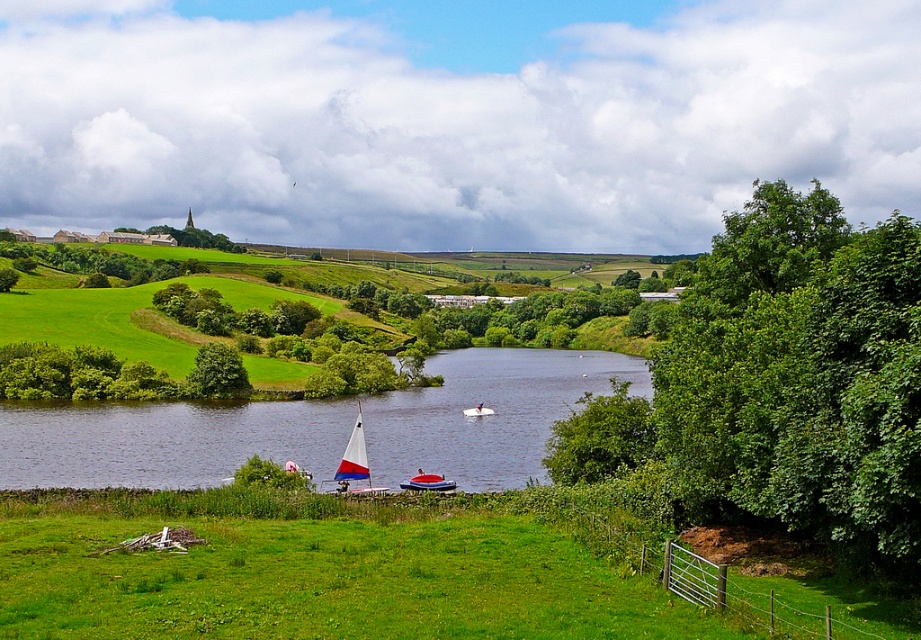
You are standing on the grassy area in the foreground and want to walk to the metal gate on the right. As you walk towards the metal gate, will the green leafy tree at right become visible above or below the green grassy river at center?

The green leafy tree at right is located above the green grassy river at center, so as you walk towards the metal gate on the right, the green leafy tree at right will continue to be visible above the green grassy river at center.